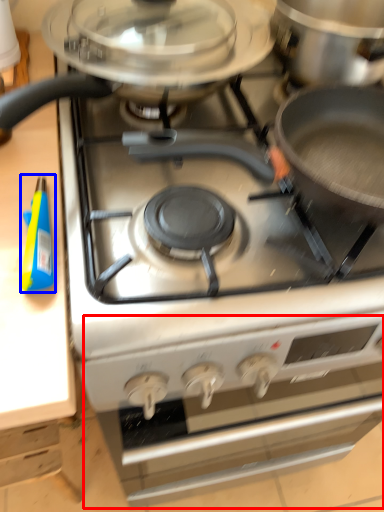
Question: Which point is further to the camera, oven (highlighted by a red box) or appliance (highlighted by a blue box)?

Choices:
 (A) oven
 (B) appliance

Answer: (A)